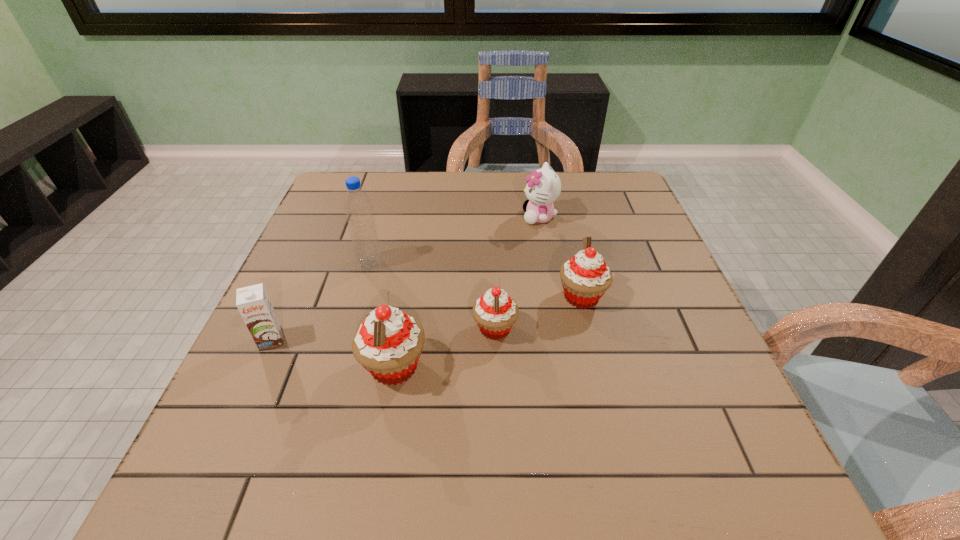
Given the evenly spaced cupcakes in the image, where should an extra cupcake be added on the right to preserve the spacing? Please point to a vacant space. Please provide its 2D coordinates. Your answer should be formatted as a tuple, i.e. [(x, y)], where the tuple contains the x and y coordinates of a point satisfying the conditions above.

[(657, 268)]